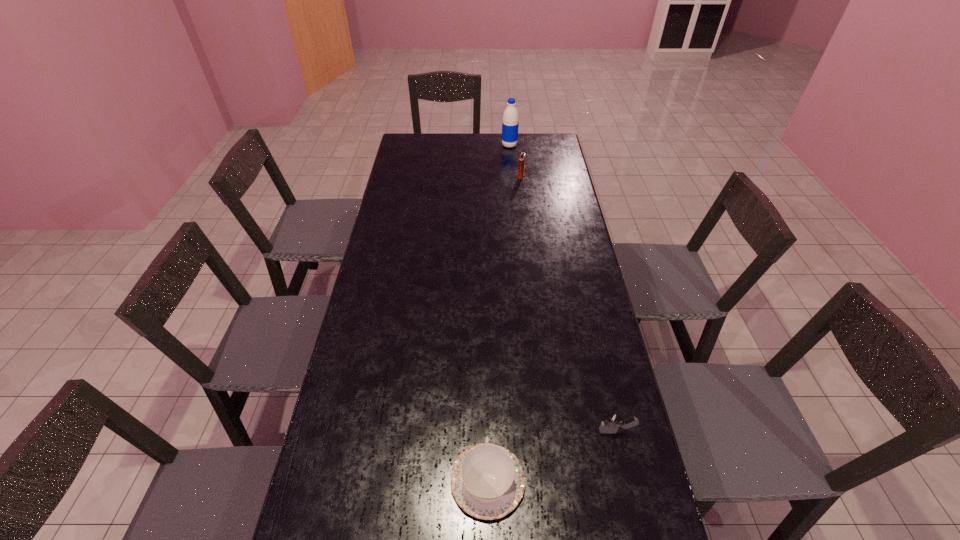
This screenshot has height=540, width=960. I want to click on the farthest object, so click(x=510, y=123).

Find the location of a particular element. water bottle is located at coordinates (510, 123).

Find the location of a particular element. This screenshot has height=540, width=960. the taller igniter is located at coordinates (522, 156).

At what (x,y) coordinates should I click in order to perform the action: click on the third shortest object. Please return your answer as a coordinate pair (x, y). The height and width of the screenshot is (540, 960). Looking at the image, I should click on (522, 156).

Identify the location of the second shortest object. (611, 422).

You are a GUI agent. You are given a task and a screenshot of the screen. Output one action in this format:
    pyautogui.click(x=<x>, y=<y>)
    Task: Click on the right igniter
    The width and height of the screenshot is (960, 540).
    Given the screenshot: What is the action you would take?
    pyautogui.click(x=611, y=422)

Locate an element on the screen. The image size is (960, 540). the leftmost object is located at coordinates (487, 481).

Where is `the nearest object`? This screenshot has height=540, width=960. the nearest object is located at coordinates (487, 481).

Locate an element on the screen. This screenshot has height=540, width=960. free space located 0.050m on the front of the tallest object is located at coordinates (511, 154).

Where is `free space located 0.150m on the front of the third nearest object`? This screenshot has width=960, height=540. free space located 0.150m on the front of the third nearest object is located at coordinates (524, 200).